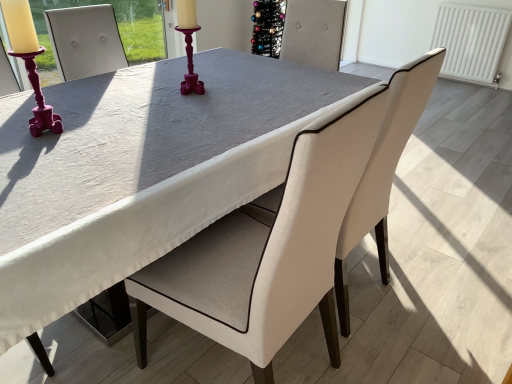
Identify the location of free location to the right of white fabric chair at center, the 2th chair positioned from the left. Image resolution: width=512 pixels, height=384 pixels. (436, 299).